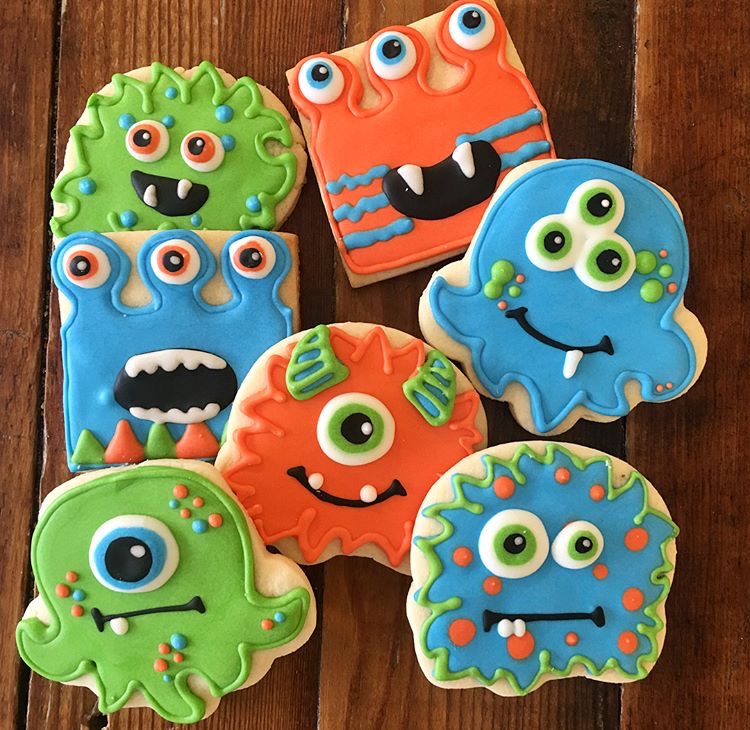
This screenshot has width=750, height=730. Identify the location of wooden plank of the table. (710, 96), (583, 69), (199, 42), (31, 73).